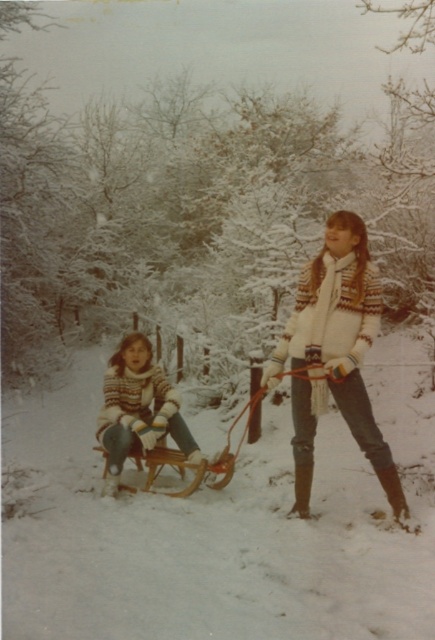
Can you confirm if white knitted sweater at center is taller than wooden sled at center?

Indeed, white knitted sweater at center has a greater height compared to wooden sled at center.

In the scene shown: Does white knitted sweater at center lie in front of wooden sled at center?

Yes, white knitted sweater at center is in front of wooden sled at center.

Find the location of a particular element. white knitted sweater at center is located at coordinates (334, 355).

Can you confirm if white wool sweater at center is positioned to the left of wooden sled at center?

Yes, white wool sweater at center is to the left of wooden sled at center.

Who is positioned more to the right, white wool sweater at center or wooden sled at center?

wooden sled at center

Does point (151, 372) come in front of point (147, 492)?

No, (151, 372) is further to viewer.

Identify the location of white wool sweater at center. pos(143,412).

Can you confirm if white knitted sweater at center is smaller than white wool sweater at center?

Yes, white knitted sweater at center is smaller than white wool sweater at center.

Can you confirm if white knitted sweater at center is taller than white wool sweater at center?

Yes, white knitted sweater at center is taller than white wool sweater at center.

Is point (351, 339) positioned after point (117, 433)?

No, it is not.

This screenshot has height=640, width=435. I want to click on white knitted sweater at center, so click(x=334, y=355).